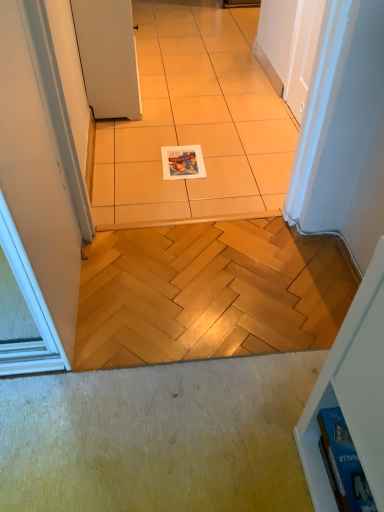
Locate an element on the screen. vacant space in front of white matte door at upper left is located at coordinates pyautogui.click(x=183, y=147).